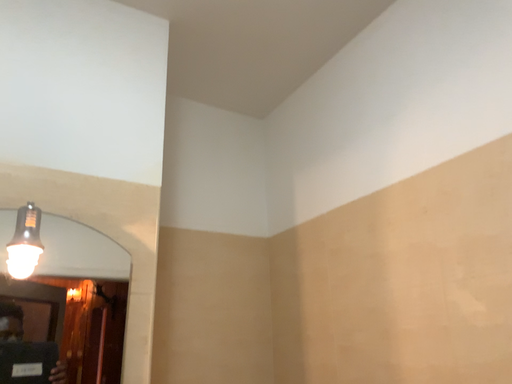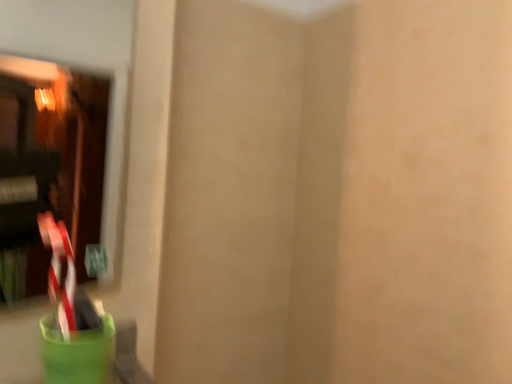
Question: Which way did the camera rotate in the video?

Choices:
 (A) rotated upward
 (B) rotated downward

Answer: (B)